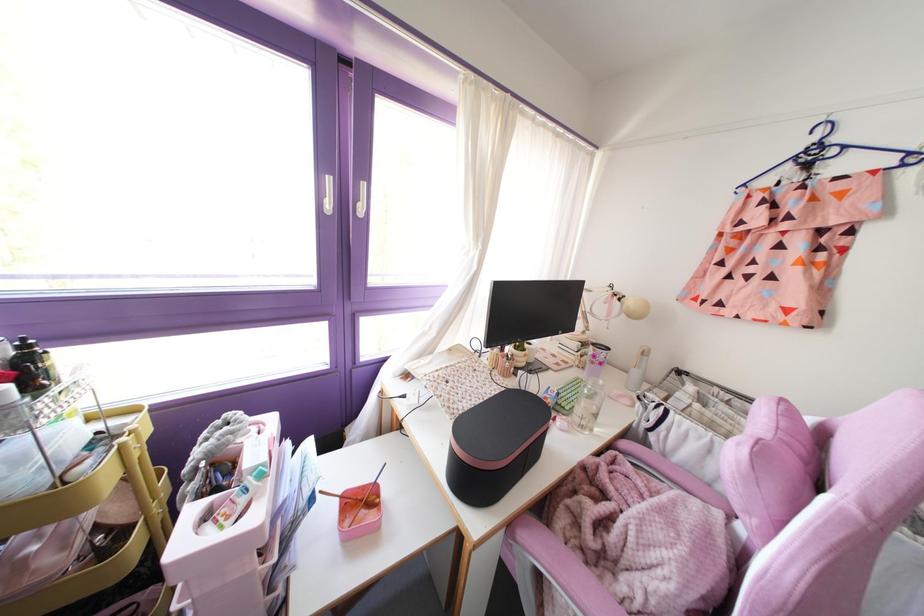
Where would you lift the blue clothes hanger? Please return your answer as a coordinate pair (x, y).

(833, 153)